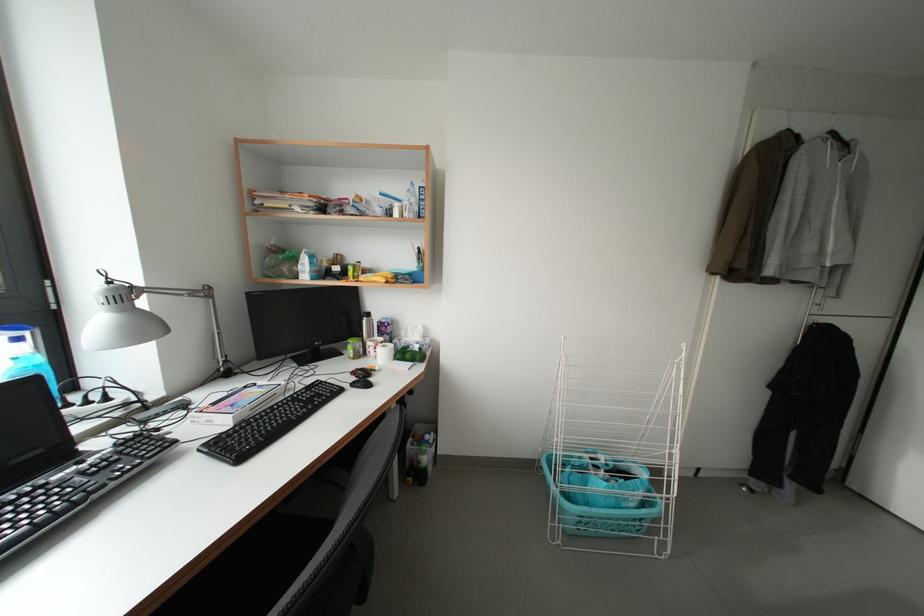
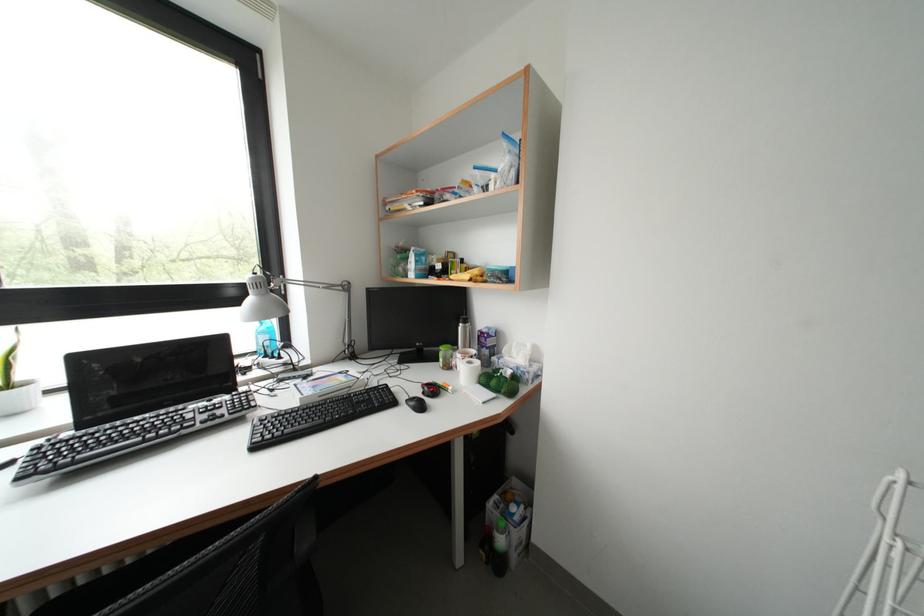
The point at (x=116, y=286) is marked in the first image. Where is the corresponding point in the second image?

(261, 278)